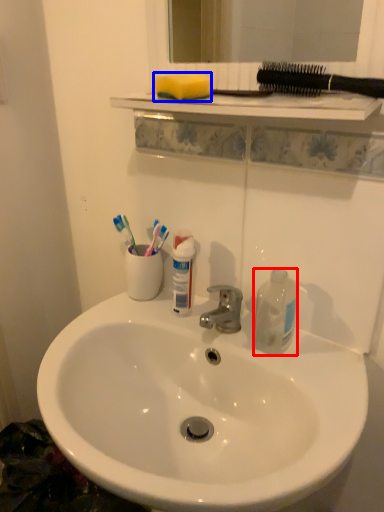
Question: Which of the following is the farthest to the observer, bottle (highlighted by a red box) or toothpick (highlighted by a blue box)?

Choices:
 (A) bottle
 (B) toothpick

Answer: (A)